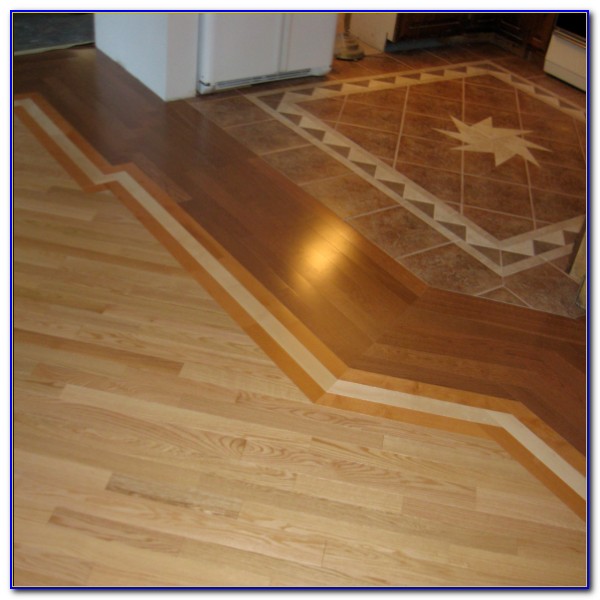
Identify the location of light hardwood flooring. The width and height of the screenshot is (600, 600). (232, 445).